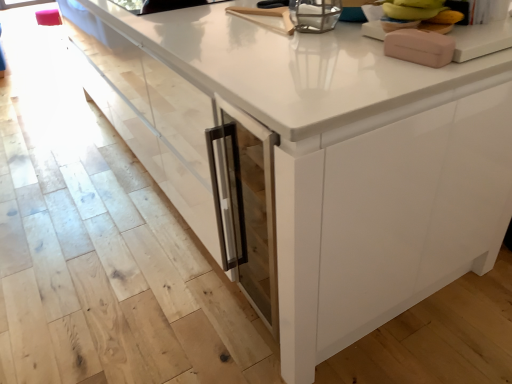
What do you see at coordinates (420, 47) in the screenshot? I see `pink matte soap dispenser at upper right, the first appliance when ordered from bottom to top` at bounding box center [420, 47].

Where is `metallic glass container at upper center, the second appliance from the front`? The height and width of the screenshot is (384, 512). metallic glass container at upper center, the second appliance from the front is located at coordinates (315, 15).

This screenshot has width=512, height=384. What do you see at coordinates (315, 15) in the screenshot? I see `metallic glass container at upper center, acting as the first appliance starting from the left` at bounding box center [315, 15].

This screenshot has width=512, height=384. Find the location of `pink matte soap dispenser at upper right, the 2th appliance when ordered from back to front`. pink matte soap dispenser at upper right, the 2th appliance when ordered from back to front is located at coordinates (420, 47).

Which of these two, metallic glass container at upper center, positioned as the 1th appliance in back-to-front order, or yellow banana at upper right, stands taller?

Standing taller between the two is yellow banana at upper right.

Which object is positioned more to the left, metallic glass container at upper center, acting as the first appliance starting from the left, or yellow banana at upper right?

Positioned to the left is metallic glass container at upper center, acting as the first appliance starting from the left.

Consider the image. From the image's perspective, between metallic glass container at upper center, the second appliance from the front, and yellow banana at upper right, which one is located above?

metallic glass container at upper center, the second appliance from the front, appears higher in the image.

Is the depth of metallic glass container at upper center, arranged as the second appliance when ordered from the bottom, less than that of yellow banana at upper right?

No, metallic glass container at upper center, arranged as the second appliance when ordered from the bottom, is further to the viewer.

Is metallic glass container at upper center, the second appliance viewed from the right, further to camera compared to pink matte soap dispenser at upper right, the first appliance when ordered from bottom to top?

Yes, it is.

Who is shorter, metallic glass container at upper center, positioned as the 1th appliance in back-to-front order, or pink matte soap dispenser at upper right, the first appliance when ordered from bottom to top?

pink matte soap dispenser at upper right, the first appliance when ordered from bottom to top, is shorter.

Is metallic glass container at upper center, acting as the first appliance starting from the left, spatially inside pink matte soap dispenser at upper right, marked as the 1th appliance in a right-to-left arrangement, or outside of it?

The correct answer is: outside.

Is metallic glass container at upper center, arranged as the 1th appliance when viewed from the top, wider or thinner than pink matte soap dispenser at upper right, acting as the second appliance starting from the left?

Clearly, metallic glass container at upper center, arranged as the 1th appliance when viewed from the top, has less width compared to pink matte soap dispenser at upper right, acting as the second appliance starting from the left.

Which of these two, yellow banana at upper right or metallic glass container at upper center, the second appliance from the front, is wider?

Wider between the two is metallic glass container at upper center, the second appliance from the front.

Is yellow banana at upper right to the left of metallic glass container at upper center, arranged as the 1th appliance when viewed from the top, from the viewer's perspective?

No.

Is the position of yellow banana at upper right less distant than that of metallic glass container at upper center, the second appliance from the front?

Yes, the depth of yellow banana at upper right is less than that of metallic glass container at upper center, the second appliance from the front.

From a real-world perspective, relative to metallic glass container at upper center, acting as the first appliance starting from the left, is yellow banana at upper right vertically above or below?

In terms of real-world spatial position, yellow banana at upper right is above metallic glass container at upper center, acting as the first appliance starting from the left.

Between pink matte soap dispenser at upper right, marked as the 1th appliance in a right-to-left arrangement, and metallic glass container at upper center, arranged as the second appliance when ordered from the bottom, which one appears on the left side from the viewer's perspective?

Positioned to the left is metallic glass container at upper center, arranged as the second appliance when ordered from the bottom.

In the scene shown: Does pink matte soap dispenser at upper right, which is the first appliance in front-to-back order, come in front of metallic glass container at upper center, arranged as the 1th appliance when viewed from the top?

Yes, pink matte soap dispenser at upper right, which is the first appliance in front-to-back order, is closer to the viewer.

Can you confirm if pink matte soap dispenser at upper right, marked as the 1th appliance in a right-to-left arrangement, is thinner than metallic glass container at upper center, positioned as the 1th appliance in back-to-front order?

No, pink matte soap dispenser at upper right, marked as the 1th appliance in a right-to-left arrangement, is not thinner than metallic glass container at upper center, positioned as the 1th appliance in back-to-front order.

Is pink matte soap dispenser at upper right, the first appliance when ordered from bottom to top, aimed at metallic glass container at upper center, positioned as the 1th appliance in back-to-front order?

Yes, pink matte soap dispenser at upper right, the first appliance when ordered from bottom to top, is oriented towards metallic glass container at upper center, positioned as the 1th appliance in back-to-front order.

Does pink matte soap dispenser at upper right, the first appliance when ordered from bottom to top, have a larger size compared to yellow banana at upper right?

Actually, pink matte soap dispenser at upper right, the first appliance when ordered from bottom to top, might be smaller than yellow banana at upper right.

In the scene shown: Considering the positions of objects pink matte soap dispenser at upper right, the first appliance when ordered from bottom to top, and yellow banana at upper right in the image provided, who is more to the left, pink matte soap dispenser at upper right, the first appliance when ordered from bottom to top, or yellow banana at upper right?

Positioned to the left is pink matte soap dispenser at upper right, the first appliance when ordered from bottom to top.

Which object is more forward, pink matte soap dispenser at upper right, the 2th appliance when ordered from back to front, or yellow banana at upper right?

pink matte soap dispenser at upper right, the 2th appliance when ordered from back to front, is more forward.

Which of these two, pink matte soap dispenser at upper right, marked as the 1th appliance in a right-to-left arrangement, or yellow banana at upper right, is wider?

pink matte soap dispenser at upper right, marked as the 1th appliance in a right-to-left arrangement.

In order to click on appliance that is below the yellow banana at upper right (from the image's perspective) in this screenshot , I will do `click(420, 47)`.

What's the angular difference between yellow banana at upper right and pink matte soap dispenser at upper right, the first appliance when ordered from bottom to top,'s facing directions?

They differ by 0.383 degrees in their facing directions.

Is yellow banana at upper right bigger than pink matte soap dispenser at upper right, the 2th appliance from the top?

Indeed, yellow banana at upper right has a larger size compared to pink matte soap dispenser at upper right, the 2th appliance from the top.

Is yellow banana at upper right shorter than pink matte soap dispenser at upper right, marked as the 1th appliance in a right-to-left arrangement?

Incorrect, the height of yellow banana at upper right does not fall short of that of pink matte soap dispenser at upper right, marked as the 1th appliance in a right-to-left arrangement.

Find the location of a particular element. The image size is (512, 384). food that appears above the metallic glass container at upper center, arranged as the 1th appliance when viewed from the top (from a real-world perspective) is located at coordinates (418, 15).

Find the location of `appliance lying on the left of pink matte soap dispenser at upper right, which is the first appliance in front-to-back order`. appliance lying on the left of pink matte soap dispenser at upper right, which is the first appliance in front-to-back order is located at coordinates (315, 15).

From the image, which object appears to be farther from metallic glass container at upper center, positioned as the 1th appliance in back-to-front order, pink matte soap dispenser at upper right, acting as the second appliance starting from the left, or yellow banana at upper right?

pink matte soap dispenser at upper right, acting as the second appliance starting from the left, is positioned further to the anchor metallic glass container at upper center, positioned as the 1th appliance in back-to-front order.

From the image, which object appears to be farther from yellow banana at upper right, pink matte soap dispenser at upper right, the 2th appliance from the top, or metallic glass container at upper center, the second appliance viewed from the right?

metallic glass container at upper center, the second appliance viewed from the right.

Based on their spatial positions, is metallic glass container at upper center, arranged as the second appliance when ordered from the bottom, or pink matte soap dispenser at upper right, marked as the 1th appliance in a right-to-left arrangement, closer to yellow banana at upper right?

Among the two, pink matte soap dispenser at upper right, marked as the 1th appliance in a right-to-left arrangement, is located nearer to yellow banana at upper right.

Based on their spatial positions, is yellow banana at upper right or pink matte soap dispenser at upper right, the first appliance when ordered from bottom to top, further from metallic glass container at upper center, the second appliance viewed from the right?

pink matte soap dispenser at upper right, the first appliance when ordered from bottom to top, is positioned further to the anchor metallic glass container at upper center, the second appliance viewed from the right.

Estimate the real-world distances between objects in this image. Which object is further from pink matte soap dispenser at upper right, marked as the 1th appliance in a right-to-left arrangement, metallic glass container at upper center, arranged as the second appliance when ordered from the bottom, or yellow banana at upper right?

metallic glass container at upper center, arranged as the second appliance when ordered from the bottom, is further to pink matte soap dispenser at upper right, marked as the 1th appliance in a right-to-left arrangement.

Considering their positions, is yellow banana at upper right positioned further to pink matte soap dispenser at upper right, the 2th appliance when ordered from back to front, than metallic glass container at upper center, the second appliance viewed from the right?

Among the two, metallic glass container at upper center, the second appliance viewed from the right, is located further to pink matte soap dispenser at upper right, the 2th appliance when ordered from back to front.

Where is `appliance located between metallic glass container at upper center, positioned as the 1th appliance in back-to-front order, and yellow banana at upper right in the left-right direction`? The width and height of the screenshot is (512, 384). appliance located between metallic glass container at upper center, positioned as the 1th appliance in back-to-front order, and yellow banana at upper right in the left-right direction is located at coordinates (420, 47).